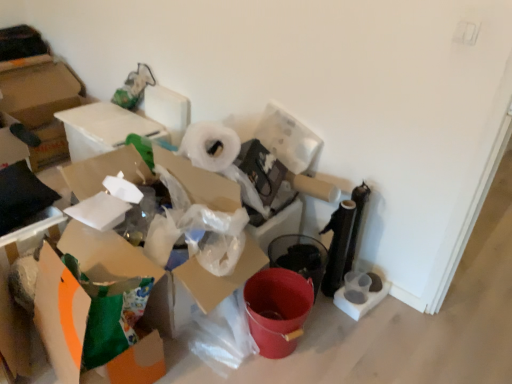
Identify the location of orange matte cardboard box at lower left, placed as the first cardboard box when sorted from front to back. The width and height of the screenshot is (512, 384). (61, 315).

Where is `transparent plastic toilet paper at lower right`? transparent plastic toilet paper at lower right is located at coordinates (360, 304).

How much distance is there between transparent plastic toilet paper at lower right and white cardboard box at upper left, marked as the 1th cardboard box in a back-to-front arrangement?

transparent plastic toilet paper at lower right is 1.57 meters from white cardboard box at upper left, marked as the 1th cardboard box in a back-to-front arrangement.

Does transparent plastic toilet paper at lower right turn towards white cardboard box at upper left, marked as the 1th cardboard box in a back-to-front arrangement?

No, transparent plastic toilet paper at lower right is not facing towards white cardboard box at upper left, marked as the 1th cardboard box in a back-to-front arrangement.

Is there a large distance between transparent plastic toilet paper at lower right and white cardboard box at upper left, marked as the 3th cardboard box in a front-to-back arrangement?

Yes, transparent plastic toilet paper at lower right and white cardboard box at upper left, marked as the 3th cardboard box in a front-to-back arrangement, are quite far apart.

You are a GUI agent. You are given a task and a screenshot of the screen. Output one action in this format:
    pyautogui.click(x=<x>, y=<y>)
    Task: Click on the 3rd cardboard box positioned above the transparent plastic toilet paper at lower right (from the image's perspective)
    The image size is (512, 384).
    Given the screenshot: What is the action you would take?
    pos(103,128)

Would you say orange matte cardboard box at lower left, which is the 2th cardboard box in back-to-front order, is to the left or to the right of white cardboard box at upper left, marked as the 3th cardboard box in a front-to-back arrangement, in the picture?

In the image, orange matte cardboard box at lower left, which is the 2th cardboard box in back-to-front order, appears on the right side of white cardboard box at upper left, marked as the 3th cardboard box in a front-to-back arrangement.

From a real-world perspective, who is located lower, orange matte cardboard box at lower left, the second cardboard box when ordered from front to back, or white cardboard box at upper left, marked as the 1th cardboard box in a back-to-front arrangement?

orange matte cardboard box at lower left, the second cardboard box when ordered from front to back, is physically lower.

Where is `cardboard box that is the 1st object located below the white cardboard box at upper left, marked as the 1th cardboard box in a back-to-front arrangement (from the image's perspective)`? cardboard box that is the 1st object located below the white cardboard box at upper left, marked as the 1th cardboard box in a back-to-front arrangement (from the image's perspective) is located at coordinates (11, 294).

Is point (369, 309) positioned in front of point (59, 226)?

That is False.

Is transparent plastic toilet paper at lower right to the right of orange matte cardboard box at lower left, the second cardboard box when ordered from front to back, from the viewer's perspective?

Indeed, transparent plastic toilet paper at lower right is positioned on the right side of orange matte cardboard box at lower left, the second cardboard box when ordered from front to back.

Is transparent plastic toilet paper at lower right next to orange matte cardboard box at lower left, the second cardboard box when ordered from front to back, and touching it?

transparent plastic toilet paper at lower right and orange matte cardboard box at lower left, the second cardboard box when ordered from front to back, are clearly separated.

Locate an element on the screen. toilet paper that is under the orange matte cardboard box at lower left, which is the 2th cardboard box in back-to-front order (from a real-world perspective) is located at coordinates (360, 304).

Does orange matte cardboard box at lower left, which is the 2th cardboard box in back-to-front order, appear on the right side of orange matte cardboard box at lower left, arranged as the 3th cardboard box when viewed from the back?

In fact, orange matte cardboard box at lower left, which is the 2th cardboard box in back-to-front order, is to the left of orange matte cardboard box at lower left, arranged as the 3th cardboard box when viewed from the back.

Does orange matte cardboard box at lower left, the second cardboard box when ordered from front to back, have a smaller size compared to orange matte cardboard box at lower left, placed as the first cardboard box when sorted from front to back?

Yes.

Is orange matte cardboard box at lower left, which is the 2th cardboard box in back-to-front order, facing away from orange matte cardboard box at lower left, placed as the first cardboard box when sorted from front to back?

No, orange matte cardboard box at lower left, which is the 2th cardboard box in back-to-front order, is not facing away from orange matte cardboard box at lower left, placed as the first cardboard box when sorted from front to back.

Would you say orange matte cardboard box at lower left, the second cardboard box when ordered from front to back, is inside or outside orange matte cardboard box at lower left, placed as the first cardboard box when sorted from front to back?

orange matte cardboard box at lower left, the second cardboard box when ordered from front to back, cannot be found inside orange matte cardboard box at lower left, placed as the first cardboard box when sorted from front to back.

How distant is transparent plastic toilet paper at lower right from orange matte cardboard box at lower left, placed as the first cardboard box when sorted from front to back?

transparent plastic toilet paper at lower right is 3.61 feet from orange matte cardboard box at lower left, placed as the first cardboard box when sorted from front to back.

This screenshot has height=384, width=512. I want to click on toilet paper that is on the right side of orange matte cardboard box at lower left, arranged as the 3th cardboard box when viewed from the back, so click(360, 304).

Which is closer, (341, 295) or (54, 368)?

Point (341, 295) appears to be farther away from the viewer than point (54, 368).

Considering the relative positions of transparent plastic toilet paper at lower right and orange matte cardboard box at lower left, placed as the first cardboard box when sorted from front to back, in the image provided, is transparent plastic toilet paper at lower right in front of orange matte cardboard box at lower left, placed as the first cardboard box when sorted from front to back,?

No, it is behind orange matte cardboard box at lower left, placed as the first cardboard box when sorted from front to back.

Is white cardboard box at upper left, marked as the 3th cardboard box in a front-to-back arrangement, facing towards orange matte cardboard box at lower left, the second cardboard box when ordered from front to back?

No.

Considering the relative positions of white cardboard box at upper left, marked as the 1th cardboard box in a back-to-front arrangement, and orange matte cardboard box at lower left, the second cardboard box when ordered from front to back, in the image provided, is white cardboard box at upper left, marked as the 1th cardboard box in a back-to-front arrangement, to the right of orange matte cardboard box at lower left, the second cardboard box when ordered from front to back, from the viewer's perspective?

In fact, white cardboard box at upper left, marked as the 1th cardboard box in a back-to-front arrangement, is to the left of orange matte cardboard box at lower left, the second cardboard box when ordered from front to back.

Considering the relative positions of white cardboard box at upper left, marked as the 1th cardboard box in a back-to-front arrangement, and orange matte cardboard box at lower left, the second cardboard box when ordered from front to back, in the image provided, is white cardboard box at upper left, marked as the 1th cardboard box in a back-to-front arrangement, behind orange matte cardboard box at lower left, the second cardboard box when ordered from front to back,?

Yes, white cardboard box at upper left, marked as the 1th cardboard box in a back-to-front arrangement, is further from the viewer.

In the scene shown: Considering the relative sizes of white cardboard box at upper left, marked as the 3th cardboard box in a front-to-back arrangement, and orange matte cardboard box at lower left, the second cardboard box when ordered from front to back, in the image provided, is white cardboard box at upper left, marked as the 3th cardboard box in a front-to-back arrangement, bigger than orange matte cardboard box at lower left, the second cardboard box when ordered from front to back,?

Indeed, white cardboard box at upper left, marked as the 3th cardboard box in a front-to-back arrangement, has a larger size compared to orange matte cardboard box at lower left, the second cardboard box when ordered from front to back.

From a real-world perspective, who is located higher, orange matte cardboard box at lower left, placed as the first cardboard box when sorted from front to back, or transparent plastic toilet paper at lower right?

In real-world perspective, orange matte cardboard box at lower left, placed as the first cardboard box when sorted from front to back, is above.

Is orange matte cardboard box at lower left, arranged as the 3th cardboard box when viewed from the back, facing towards transparent plastic toilet paper at lower right?

No, orange matte cardboard box at lower left, arranged as the 3th cardboard box when viewed from the back, is not oriented towards transparent plastic toilet paper at lower right.

In terms of width, does orange matte cardboard box at lower left, placed as the first cardboard box when sorted from front to back, look wider or thinner when compared to transparent plastic toilet paper at lower right?

In the image, orange matte cardboard box at lower left, placed as the first cardboard box when sorted from front to back, appears to be wider than transparent plastic toilet paper at lower right.

There is a transparent plastic toilet paper at lower right. Where is `the 3rd cardboard box above it (from the image's perspective)`? This screenshot has width=512, height=384. the 3rd cardboard box above it (from the image's perspective) is located at coordinates 103,128.

In order to click on cardboard box directly beneath the white cardboard box at upper left, marked as the 1th cardboard box in a back-to-front arrangement (from a real-world perspective) in this screenshot , I will do `click(11, 294)`.

Based on their spatial positions, is orange matte cardboard box at lower left, the second cardboard box when ordered from front to back, or orange matte cardboard box at lower left, placed as the first cardboard box when sorted from front to back, further from transparent plastic toilet paper at lower right?

orange matte cardboard box at lower left, the second cardboard box when ordered from front to back, is further to transparent plastic toilet paper at lower right.

In the scene shown: Looking at the image, which one is located closer to transparent plastic toilet paper at lower right, white cardboard box at upper left, marked as the 1th cardboard box in a back-to-front arrangement, or orange matte cardboard box at lower left, which is the 2th cardboard box in back-to-front order?

Among the two, orange matte cardboard box at lower left, which is the 2th cardboard box in back-to-front order, is located nearer to transparent plastic toilet paper at lower right.

Considering their positions, is white cardboard box at upper left, marked as the 3th cardboard box in a front-to-back arrangement, positioned closer to orange matte cardboard box at lower left, which is the 2th cardboard box in back-to-front order, than transparent plastic toilet paper at lower right?

Among the two, white cardboard box at upper left, marked as the 3th cardboard box in a front-to-back arrangement, is located nearer to orange matte cardboard box at lower left, which is the 2th cardboard box in back-to-front order.

Based on their spatial positions, is white cardboard box at upper left, marked as the 1th cardboard box in a back-to-front arrangement, or orange matte cardboard box at lower left, arranged as the 3th cardboard box when viewed from the back, closer to transparent plastic toilet paper at lower right?

Based on the image, orange matte cardboard box at lower left, arranged as the 3th cardboard box when viewed from the back, appears to be nearer to transparent plastic toilet paper at lower right.

Which object lies further to the anchor point orange matte cardboard box at lower left, which is the 2th cardboard box in back-to-front order, transparent plastic toilet paper at lower right or orange matte cardboard box at lower left, placed as the first cardboard box when sorted from front to back?

Among the two, transparent plastic toilet paper at lower right is located further to orange matte cardboard box at lower left, which is the 2th cardboard box in back-to-front order.

Based on their spatial positions, is orange matte cardboard box at lower left, placed as the first cardboard box when sorted from front to back, or white cardboard box at upper left, marked as the 3th cardboard box in a front-to-back arrangement, closer to transparent plastic toilet paper at lower right?

orange matte cardboard box at lower left, placed as the first cardboard box when sorted from front to back, is positioned closer to the anchor transparent plastic toilet paper at lower right.

From the image, which object appears to be farther from transparent plastic toilet paper at lower right, orange matte cardboard box at lower left, arranged as the 3th cardboard box when viewed from the back, or orange matte cardboard box at lower left, the second cardboard box when ordered from front to back?

Among the two, orange matte cardboard box at lower left, the second cardboard box when ordered from front to back, is located further to transparent plastic toilet paper at lower right.

Estimate the real-world distances between objects in this image. Which object is closer to white cardboard box at upper left, marked as the 1th cardboard box in a back-to-front arrangement, orange matte cardboard box at lower left, placed as the first cardboard box when sorted from front to back, or transparent plastic toilet paper at lower right?

orange matte cardboard box at lower left, placed as the first cardboard box when sorted from front to back, is closer to white cardboard box at upper left, marked as the 1th cardboard box in a back-to-front arrangement.

The image size is (512, 384). What are the coordinates of `cardboard box located between orange matte cardboard box at lower left, placed as the first cardboard box when sorted from front to back, and white cardboard box at upper left, marked as the 1th cardboard box in a back-to-front arrangement, in the depth direction` in the screenshot? It's located at (11, 294).

Locate an element on the screen. The width and height of the screenshot is (512, 384). cardboard box between orange matte cardboard box at lower left, the second cardboard box when ordered from front to back, and transparent plastic toilet paper at lower right from left to right is located at coordinates (61, 315).